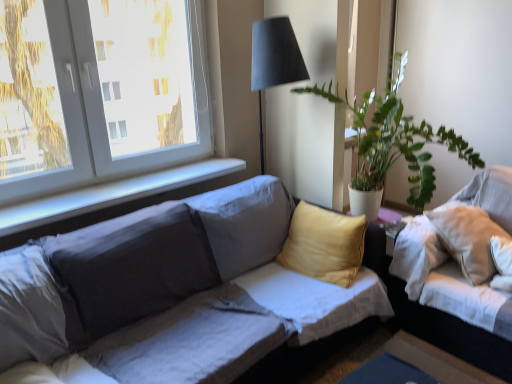
Question: Looking at the image, does matte gray couch at center, the first studio couch viewed from the left, seem bigger or smaller compared to white fabric couch at right, the 1th studio couch positioned from the right?

Choices:
 (A) big
 (B) small

Answer: (A)

Question: Looking at their shapes, would you say matte gray couch at center, the first studio couch viewed from the left, is wider or thinner than white fabric couch at right, marked as the 2th studio couch in a left-to-right arrangement?

Choices:
 (A) thin
 (B) wide

Answer: (B)

Question: Which object is the closest to the white smooth window sill at upper left?

Choices:
 (A) matte gray couch at center, the first studio couch viewed from the left
 (B) white fabric couch at right, the 1th studio couch positioned from the right
 (C) white plastic window at upper left
 (D) green leafy plant at upper right

Answer: (C)

Question: Estimate the real-world distances between objects in this image. Which object is closer to the white smooth window sill at upper left?

Choices:
 (A) green leafy plant at upper right
 (B) white plastic window at upper left
 (C) matte gray couch at center, the first studio couch viewed from the left
 (D) white fabric couch at right, marked as the 2th studio couch in a left-to-right arrangement

Answer: (B)